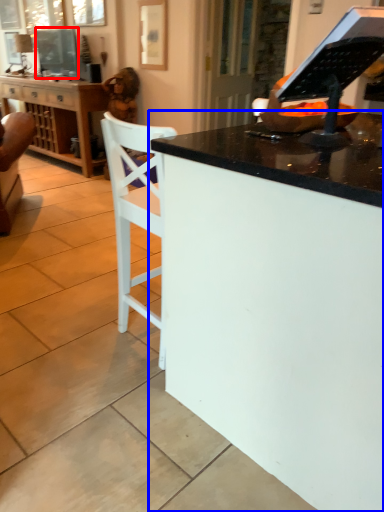
Question: Which object appears farthest to the camera in this image, television (highlighted by a red box) or desk (highlighted by a blue box)?

Choices:
 (A) television
 (B) desk

Answer: (A)